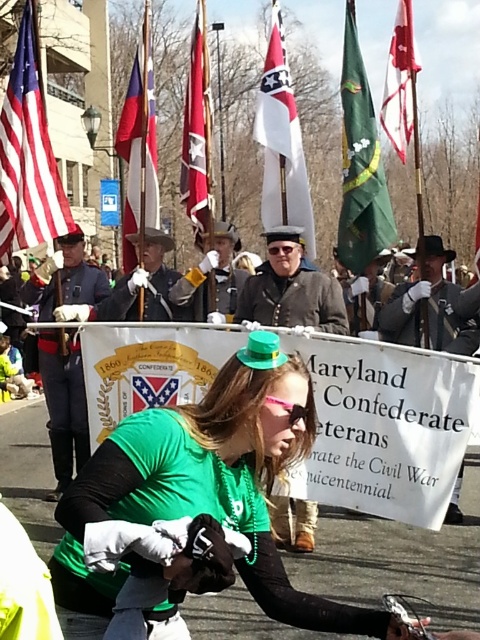
Question: Which point is closer to the camera taking this photo?

Choices:
 (A) (352, 38)
 (B) (410, 40)
 (C) (277, 168)
 (D) (402, 304)

Answer: (B)

Question: Is green fabric flag at center to the right of red fabric flag at center from the viewer's perspective?

Choices:
 (A) no
 (B) yes

Answer: (A)

Question: Which point is farther to the camera?

Choices:
 (A) tap(202, 93)
 (B) tap(31, 138)
 (C) tap(300, 272)

Answer: (A)

Question: Does green matte hat at center have a lesser width compared to white matte flag at center?

Choices:
 (A) no
 (B) yes

Answer: (A)

Question: Among these points, which one is nearest to the camera?

Choices:
 (A) click(34, 76)
 (B) click(173, 524)
 (C) click(238, 300)
 (D) click(180, 184)

Answer: (B)

Question: Can you confirm if shiny blue uniform at center is positioned to the right of red fabric flag at upper right?

Choices:
 (A) yes
 (B) no

Answer: (B)